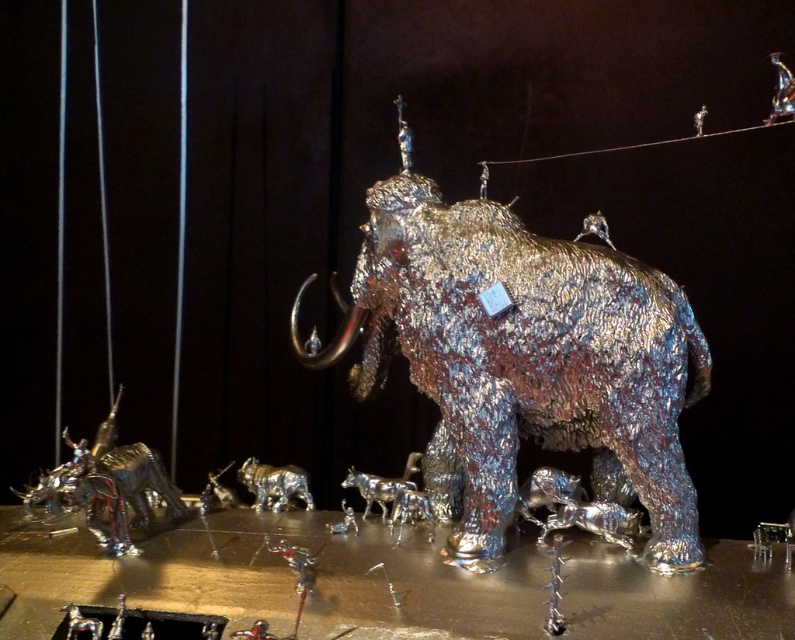
Looking at this image, you are an art curator planning to move the shiny metallic dinosaur at lower left closer to the shiny metallic elephant at center for an exhibition. Based on their current arrangement, will moving the dinosaur closer to the elephant require moving it from behind or in front of the elephant?

The shiny metallic elephant at center is positioned over shiny metallic dinosaur at lower left, so moving the dinosaur closer to the elephant would require moving it from behind the elephant since it is currently behind it.

You are standing in front of the metallic sculptures display. You see a point at coordinate (520, 356). What object is located at that point?

The point at coordinate (520, 356) indicates the shiny metallic elephant at center.

You are an art curator planning to move the shiny metallic dinosaur at lower left closer to the shiny metallic elephant at center. Given that the elephant is wider than the dinosaur, will the dinosaur fit within the space currently occupied by the elephant?

The shiny metallic elephant at center is wider than the shiny metallic dinosaur at lower left. Since the dinosaur is narrower, it will fit within the space currently occupied by the elephant.